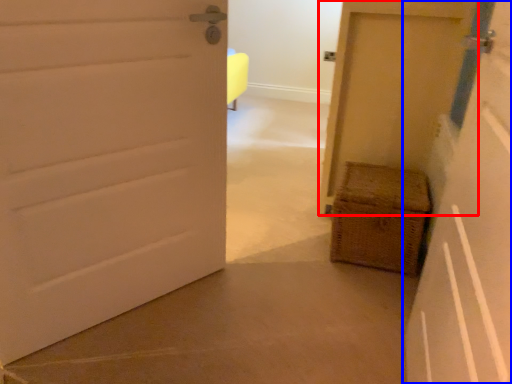
Question: Among these objects, which one is nearest to the camera, door (highlighted by a red box) or door (highlighted by a blue box)?

Choices:
 (A) door
 (B) door

Answer: (B)